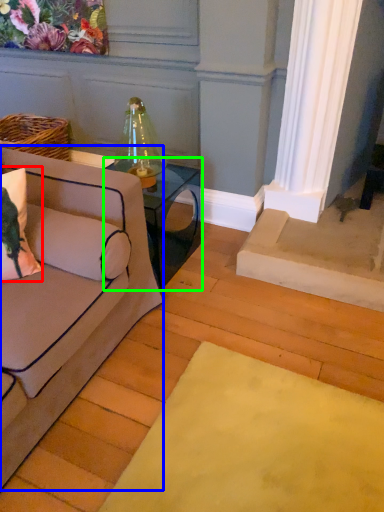
Question: Which object is positioned farthest from pillow (highlighted by a red box)? Select from studio couch (highlighted by a blue box) and table (highlighted by a green box).

Choices:
 (A) studio couch
 (B) table

Answer: (B)